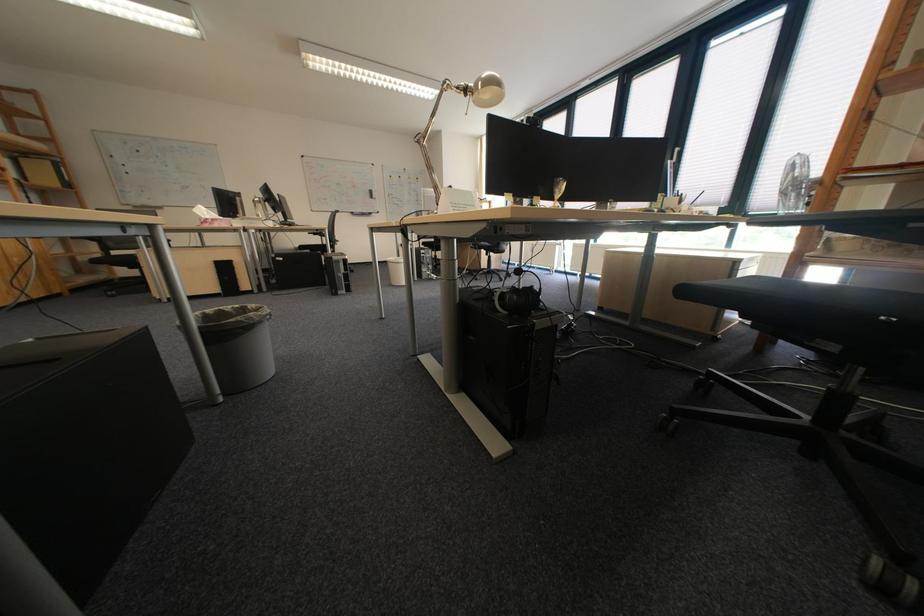
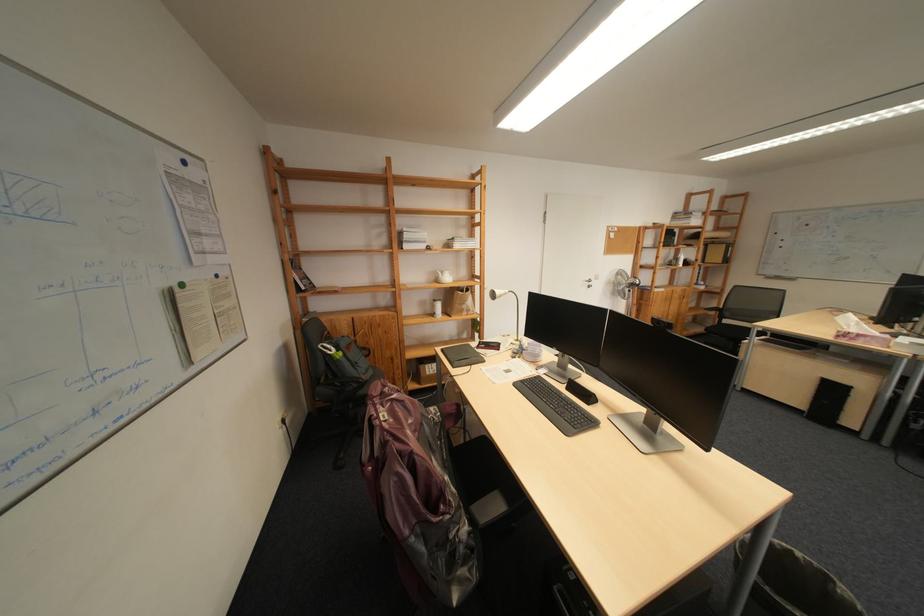
The first image is from the beginning of the video and the second image is from the end. How did the camera likely rotate when shooting the video?

The rotation direction of the camera is left-down.